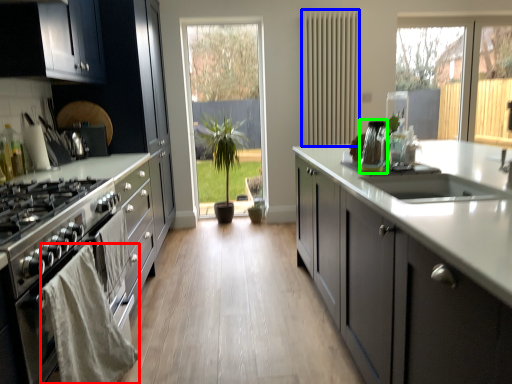
Question: Considering the real-world distances, which object is closest to material (highlighted by a red box)? radiator (highlighted by a blue box) or appliance (highlighted by a green box).

Choices:
 (A) radiator
 (B) appliance

Answer: (B)